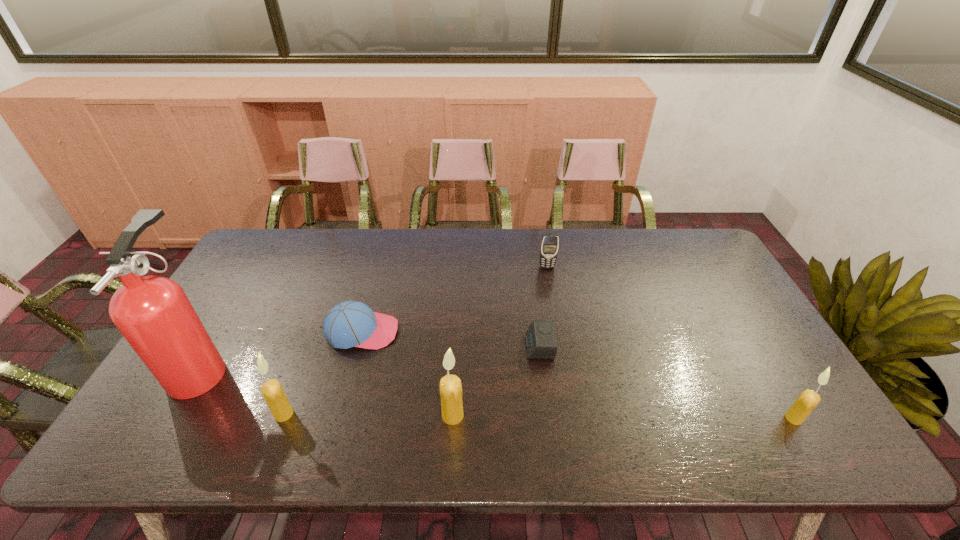
Where is `vacant area located on the front-facing side of the shortest object`? Image resolution: width=960 pixels, height=540 pixels. vacant area located on the front-facing side of the shortest object is located at coordinates (468, 347).

Locate an element on the screen. The width and height of the screenshot is (960, 540). object present at the far edge is located at coordinates (549, 245).

Locate an element on the screen. fire extinguisher that is at the near edge is located at coordinates (153, 313).

Find the location of a particular element. This screenshot has width=960, height=540. object present at the left edge is located at coordinates click(153, 313).

Image resolution: width=960 pixels, height=540 pixels. What are the coordinates of `object positioned at the right edge` in the screenshot? It's located at (807, 401).

Where is `object that is at the near left corner`? The height and width of the screenshot is (540, 960). object that is at the near left corner is located at coordinates (153, 313).

Where is `object that is at the near right corner`? object that is at the near right corner is located at coordinates (807, 401).

Find the location of `free space at the far edge of the desktop`. free space at the far edge of the desktop is located at coordinates (536, 234).

Identify the location of vacant space at the near edge of the desktop. The height and width of the screenshot is (540, 960). (699, 400).

Where is `free spot at the left edge of the desktop`? The height and width of the screenshot is (540, 960). free spot at the left edge of the desktop is located at coordinates (226, 351).